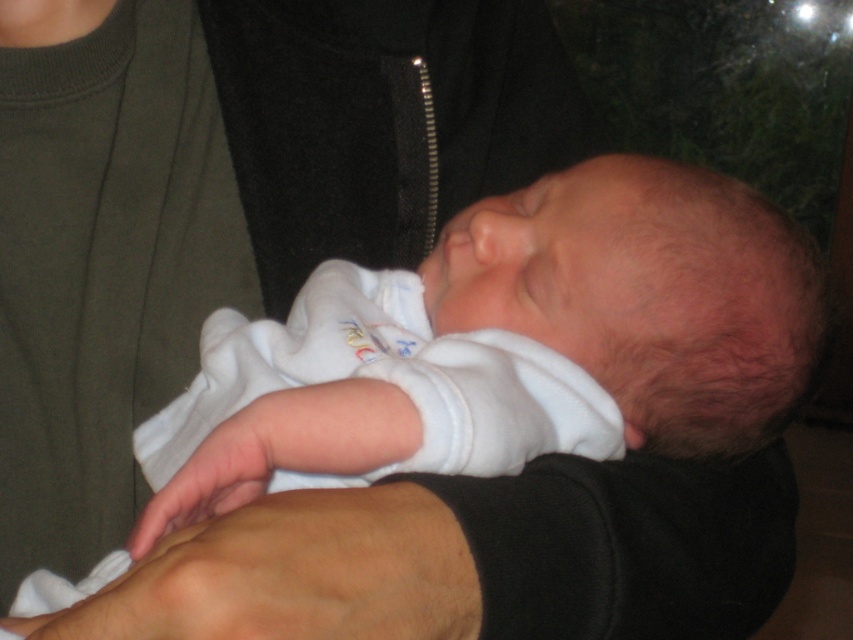
Based on the photo, is white soft fabric newborn at center to the left of smooth skin hand at lower center from the viewer's perspective?

In fact, white soft fabric newborn at center is to the right of smooth skin hand at lower center.

Does white soft fabric newborn at center lie behind smooth skin hand at lower center?

Yes, it is behind smooth skin hand at lower center.

Which is behind, point (349, 396) or point (82, 637)?

Point (349, 396)

I want to click on white soft fabric newborn at center, so click(640, 301).

Can you confirm if white soft fabric at center is smaller than smooth skin hand at lower center?

Incorrect, white soft fabric at center is not smaller in size than smooth skin hand at lower center.

Where is `white soft fabric at center`? The image size is (853, 640). white soft fabric at center is located at coordinates (x=479, y=557).

Does point (302, 500) lie behind point (149, 573)?

Yes, point (302, 500) is behind point (149, 573).

Where is `white soft fabric at center`? The width and height of the screenshot is (853, 640). white soft fabric at center is located at coordinates (479, 557).

Where is `white soft fabric newborn at center`? The width and height of the screenshot is (853, 640). white soft fabric newborn at center is located at coordinates (640, 301).

Who is lower down, white soft fabric newborn at center or white soft fabric at center?

white soft fabric at center is lower down.

Which is in front, point (784, 332) or point (630, 579)?

Positioned in front is point (630, 579).

Locate an element on the screen. This screenshot has width=853, height=640. white soft fabric newborn at center is located at coordinates (640, 301).